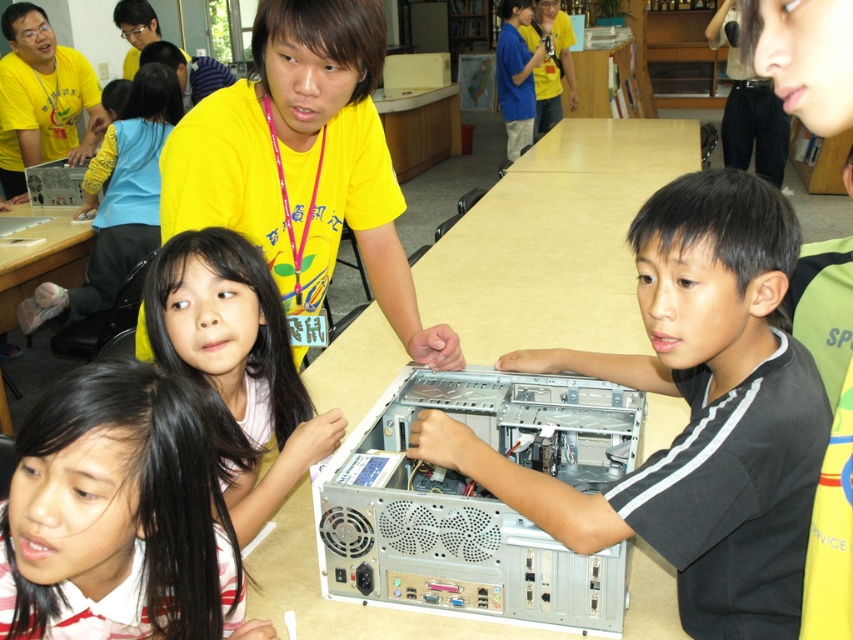
Question: Can you confirm if silver metallic computer case at center is positioned to the left of blue/yellow shirt at upper center?

Choices:
 (A) no
 (B) yes

Answer: (B)

Question: Which point is farther from the camera taking this photo?

Choices:
 (A) (44, 403)
 (B) (141, 124)

Answer: (B)

Question: Which point is farther from the camera taking this photo?

Choices:
 (A) (337, 588)
 (B) (526, 144)

Answer: (B)

Question: Which point is closer to the camera?

Choices:
 (A) (102, 289)
 (B) (183, 289)
 (C) (358, 596)

Answer: (B)

Question: Can you confirm if silver metallic computer at center is positioned below matte yellow shirt at center?

Choices:
 (A) no
 (B) yes

Answer: (B)

Question: Considering the relative positions of matte yellow shirt at center and blue/yellow shirt at upper center in the image provided, where is matte yellow shirt at center located with respect to blue/yellow shirt at upper center?

Choices:
 (A) below
 (B) above

Answer: (A)